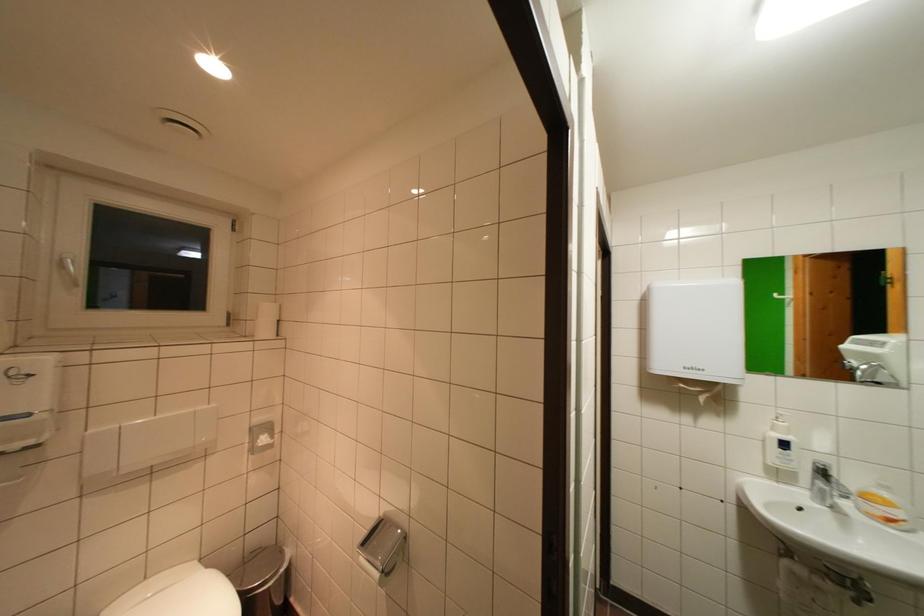
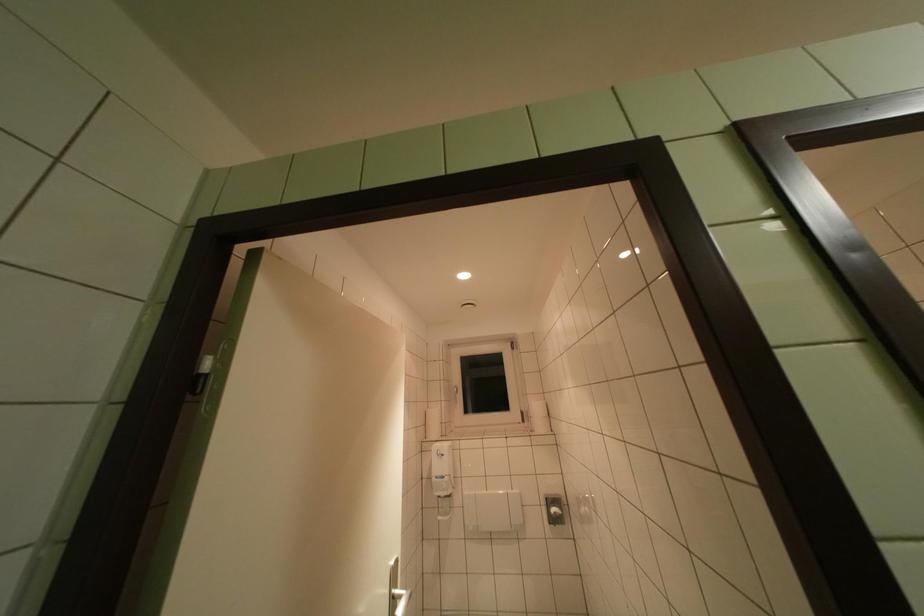
Based on the continuous images, in which direction is the camera rotating?

The rotation direction of the camera is left-up.